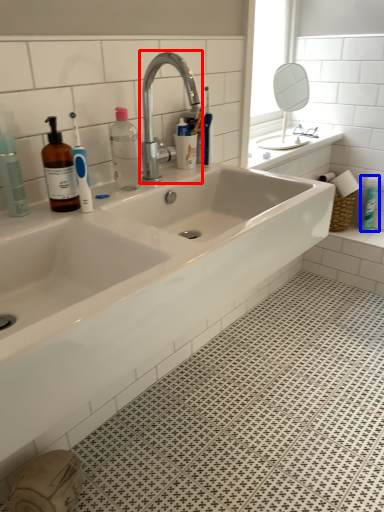
Question: Among these objects, which one is nearest to the camera, tap (highlighted by a red box) or toiletry (highlighted by a blue box)?

Choices:
 (A) tap
 (B) toiletry

Answer: (A)